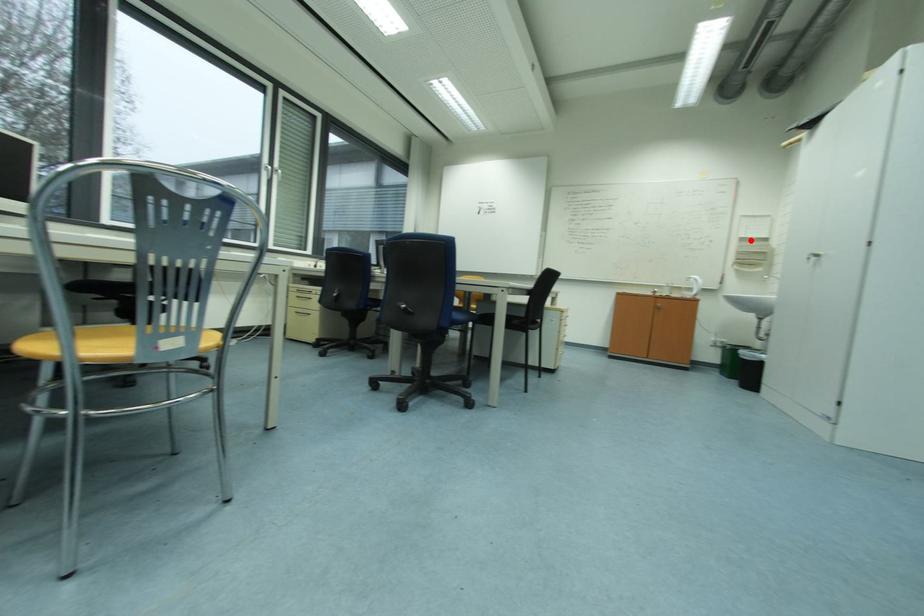
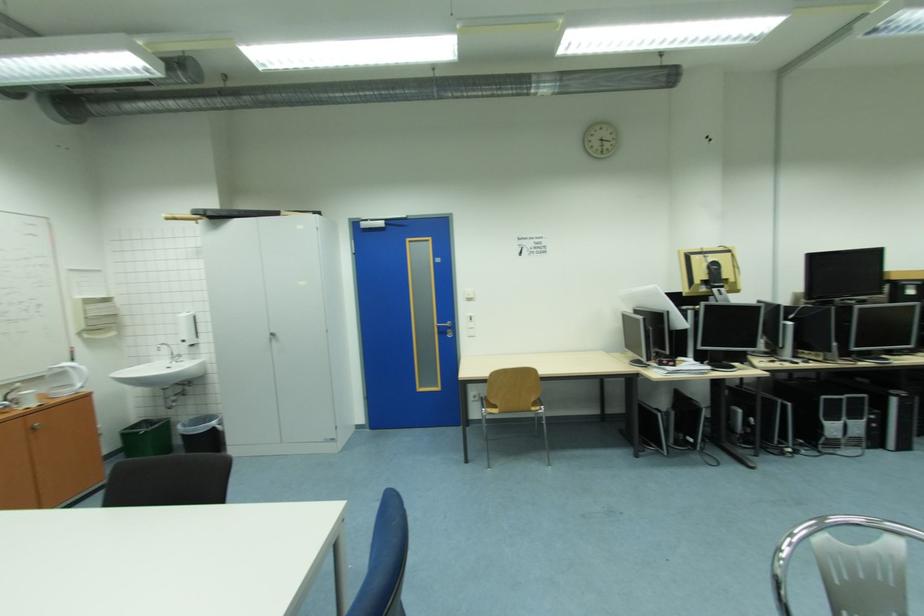
The point at the highlighted location is marked in the first image. Where is the corresponding point in the second image?

(94, 302)